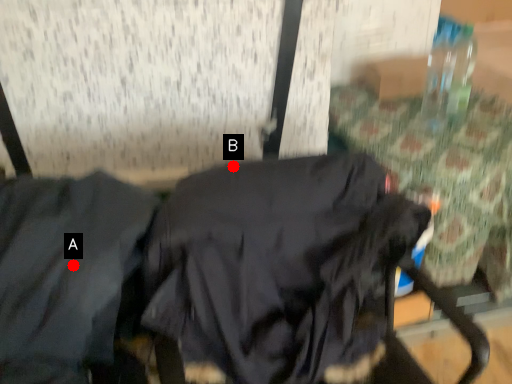
Question: Two points are circled on the image, labeled by A and B beside each circle. Which of the following is the farthest from the observer?

Choices:
 (A) A is further
 (B) B is further

Answer: (B)